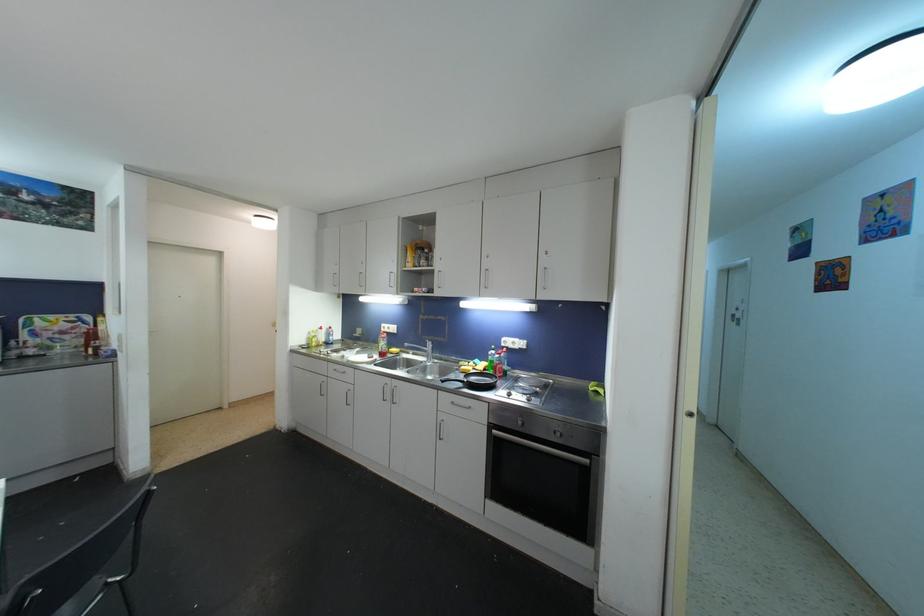
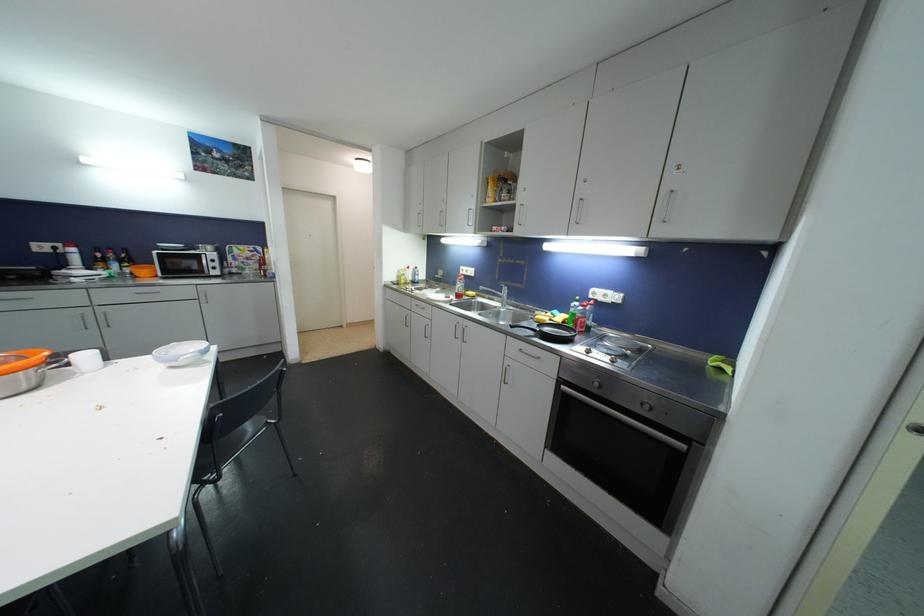
The point at (x=557, y=436) is marked in the first image. Where is the corresponding point in the second image?

(646, 407)